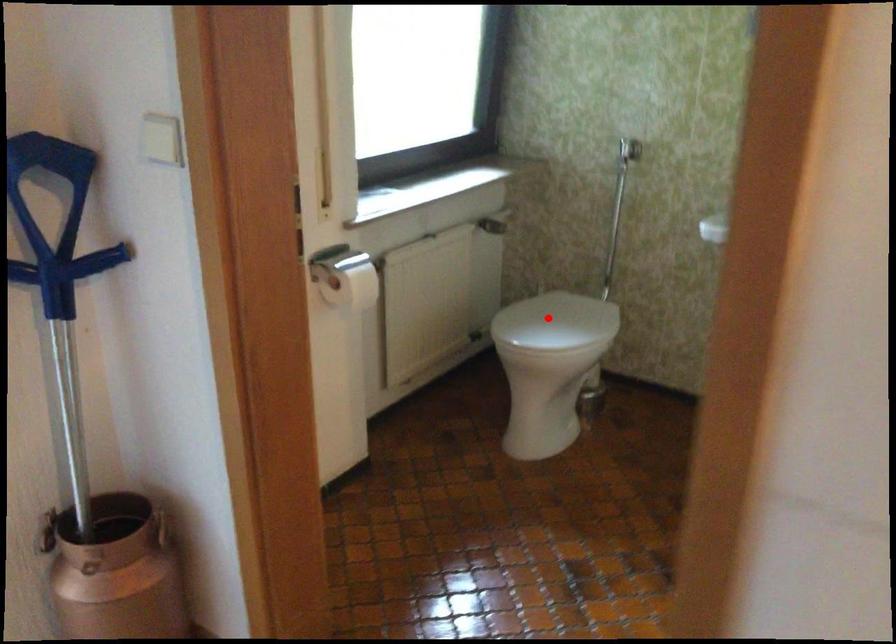
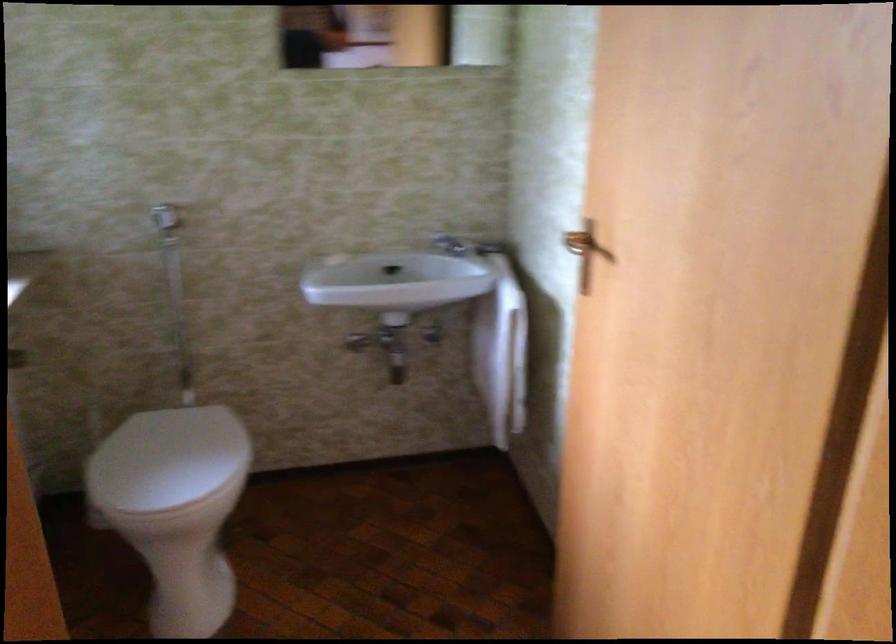
Find the pixel in the second image that matches the highlighted location in the first image.

(167, 460)